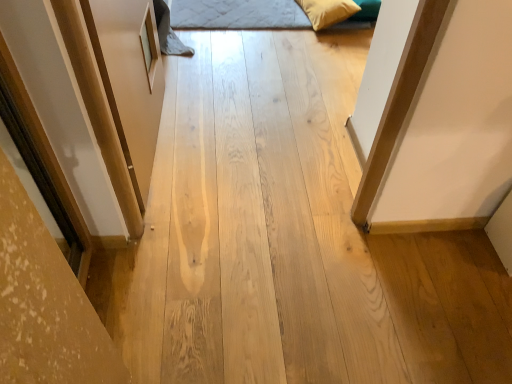
Question: Is velvet yellow pillow at upper right to the right of quilted fabric bed at upper center from the viewer's perspective?

Choices:
 (A) no
 (B) yes

Answer: (B)

Question: From the image's perspective, is velvet yellow pillow at upper right located above quilted fabric bed at upper center?

Choices:
 (A) no
 (B) yes

Answer: (B)

Question: Does velvet yellow pillow at upper right lie behind quilted fabric bed at upper center?

Choices:
 (A) yes
 (B) no

Answer: (B)

Question: Considering the relative sizes of velvet yellow pillow at upper right and quilted fabric bed at upper center in the image provided, is velvet yellow pillow at upper right bigger than quilted fabric bed at upper center?

Choices:
 (A) no
 (B) yes

Answer: (A)

Question: Is quilted fabric bed at upper center completely or partially inside velvet yellow pillow at upper right?

Choices:
 (A) no
 (B) yes

Answer: (A)

Question: Is velvet yellow pillow at upper right smaller than quilted fabric bed at upper center?

Choices:
 (A) yes
 (B) no

Answer: (A)

Question: Is quilted fabric bed at upper center next to velvet yellow pillow at upper right and touching it?

Choices:
 (A) yes
 (B) no

Answer: (B)

Question: Is the depth of quilted fabric bed at upper center greater than that of velvet yellow pillow at upper right?

Choices:
 (A) yes
 (B) no

Answer: (A)

Question: From the image's perspective, is quilted fabric bed at upper center beneath velvet yellow pillow at upper right?

Choices:
 (A) no
 (B) yes

Answer: (B)

Question: Is quilted fabric bed at upper center located outside velvet yellow pillow at upper right?

Choices:
 (A) no
 (B) yes

Answer: (B)

Question: Considering the relative sizes of quilted fabric bed at upper center and velvet yellow pillow at upper right in the image provided, is quilted fabric bed at upper center wider than velvet yellow pillow at upper right?

Choices:
 (A) yes
 (B) no

Answer: (A)

Question: Is quilted fabric bed at upper center shorter than velvet yellow pillow at upper right?

Choices:
 (A) yes
 (B) no

Answer: (A)

Question: Relative to velvet yellow pillow at upper right, is quilted fabric bed at upper center in front or behind?

Choices:
 (A) front
 (B) behind

Answer: (B)